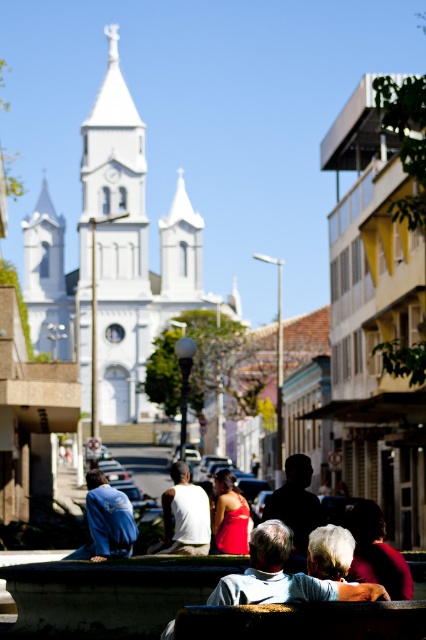
You are a photographer trying to capture the dark red fabric at lower right in the scene. Based on its 2D coordinates, where exactly should you position your camera to ensure it is centered in your shot?

To center the dark red fabric at lower right in your shot, position your camera so that it aligns with the coordinates point (376,552).

You are standing at the point with coordinates point (298, 458) and want to walk to the point with coordinates point (353, 513). Which direction should you move in relation to the church?

You should move towards the church because point (353, 513) is in front of point (298, 458).